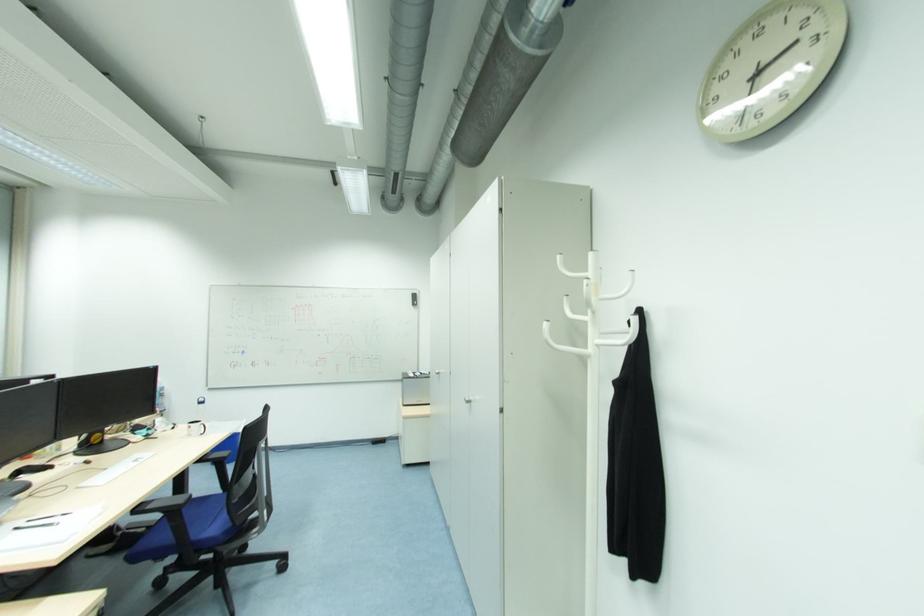
You are a GUI agent. You are given a task and a screenshot of the screen. Output one action in this format:
    pyautogui.click(x=<x>, y=<y>)
    Task: Click on the whiteboard eraser
    
    Given the screenshot: What is the action you would take?
    pyautogui.click(x=418, y=298)